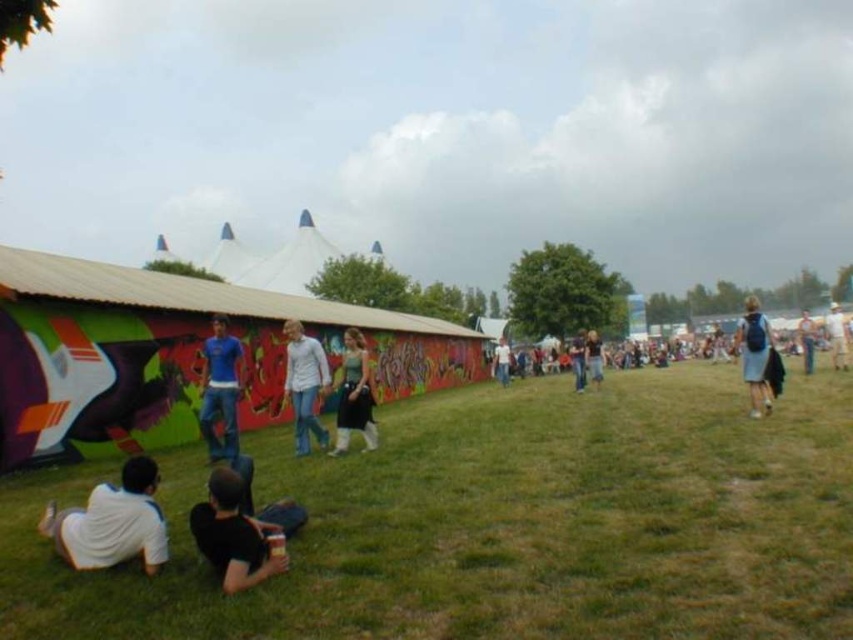
From the picture: Is white matte shirt at lower left further to camera compared to green fabric dress at center?

That is False.

Which is in front, point (142, 461) or point (357, 394)?

Point (142, 461) is in front.

Is point (140, 461) closer to camera compared to point (344, 400)?

Yes, point (140, 461) is in front of point (344, 400).

Identify the location of white matte shirt at lower left. click(112, 522).

Does blue backpack at right have a greater height compared to light blue denim jeans at center?

No, blue backpack at right is not taller than light blue denim jeans at center.

Does blue backpack at right have a lesser height compared to light blue denim jeans at center?

Indeed, blue backpack at right has a lesser height compared to light blue denim jeans at center.

The height and width of the screenshot is (640, 853). What do you see at coordinates (755, 356) in the screenshot?
I see `blue backpack at right` at bounding box center [755, 356].

Where is `blue backpack at right`? The height and width of the screenshot is (640, 853). blue backpack at right is located at coordinates (755, 356).

Who is taller, denim jeans at center or green dress at center?

With more height is denim jeans at center.

What do you see at coordinates (578, 358) in the screenshot?
I see `denim jeans at center` at bounding box center [578, 358].

The image size is (853, 640). What do you see at coordinates (578, 358) in the screenshot?
I see `denim jeans at center` at bounding box center [578, 358].

The image size is (853, 640). What are the coordinates of `denim jeans at center` in the screenshot? It's located at (578, 358).